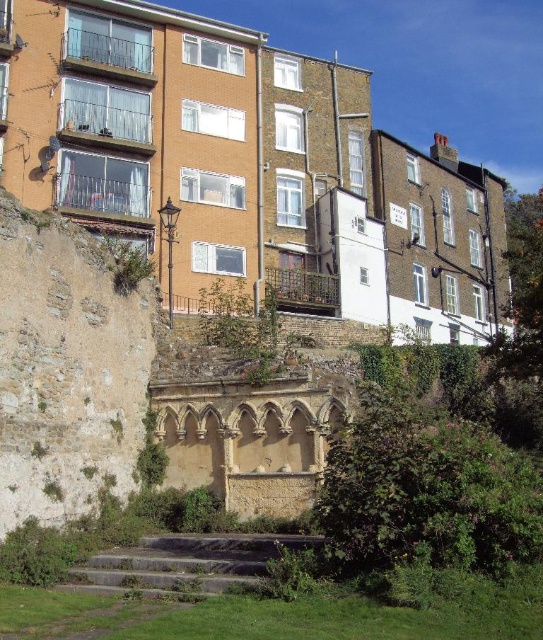
Question: Which point is farther to the camera?

Choices:
 (A) clear glass balcony at left
 (B) metallic silver balcony at center

Answer: (B)

Question: Which point is farther to the camera?

Choices:
 (A) clear glass balcony at upper left
 (B) metallic silver balcony at upper left
 (C) clear glass balcony at left
 (D) metallic silver balcony at center

Answer: (D)

Question: Is granite steps at lower center wider than clear glass balcony at upper left?

Choices:
 (A) yes
 (B) no

Answer: (A)

Question: Can you confirm if weathered stone wall at lower left is positioned to the right of clear glass balcony at upper left?

Choices:
 (A) yes
 (B) no

Answer: (A)

Question: Does clear glass balcony at left appear on the left side of metallic silver balcony at center?

Choices:
 (A) no
 (B) yes

Answer: (B)

Question: Which object appears farthest from the camera in this image?

Choices:
 (A) granite steps at lower center
 (B) weathered stone wall at lower left

Answer: (B)